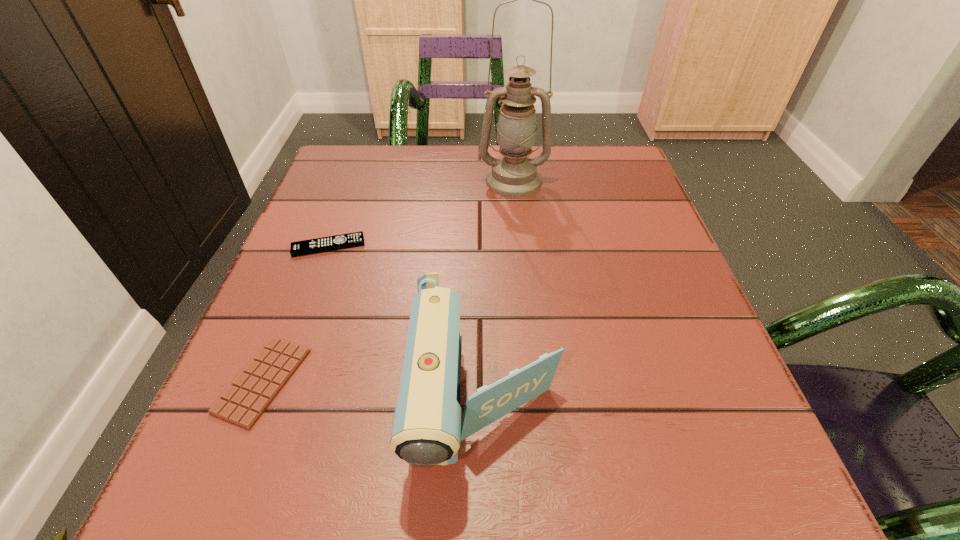
Locate which object is the closest to the second farthest object. Please provide its 2D coordinates. Your answer should be formatted as a tuple, i.e. [(x, y)], where the tuple contains the x and y coordinates of a point satisfying the conditions above.

[(243, 403)]

You are a GUI agent. You are given a task and a screenshot of the screen. Output one action in this format:
    pyautogui.click(x=<x>, y=<y>)
    Task: Click on the vacant space that satisfies the following two spatial constraints: 1. on the back side of the tallest object; 2. on the left side of the candy bar
    The image size is (960, 540).
    Given the screenshot: What is the action you would take?
    pyautogui.click(x=343, y=180)